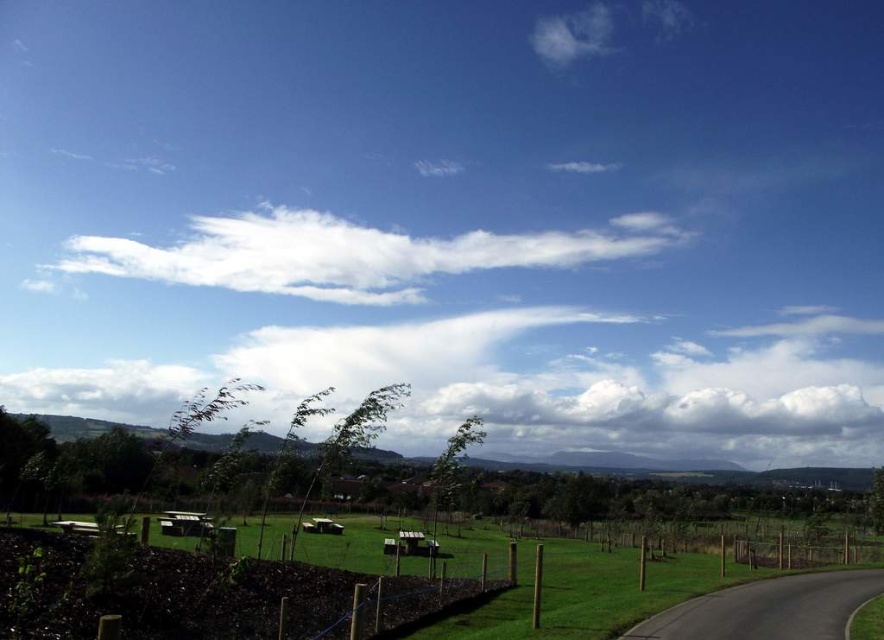
You are a drone operator who needs to capture a photo of the green grass at lower center and the white fluffy cloud at upper center. The drone can only fly up to 500 meters. Will the drone be able to capture both subjects in a single photo without moving?

The green grass at lower center is 533.64 meters from the white fluffy cloud at upper center, which exceeds the drone flight limit of 500 meters. Therefore, the drone cannot capture both subjects in one photo without moving.

In the scene shown: You are a farmer standing in the middle of the green grass at lower center. You look up and see the white fluffy cloud at upper center. Which object is taller?

The white fluffy cloud at upper center is taller than the green grass at lower center.